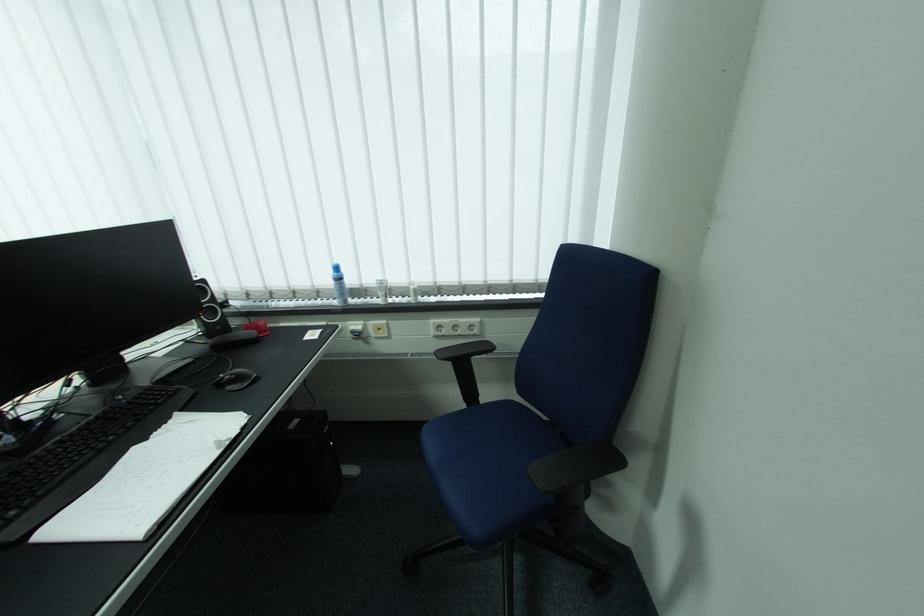
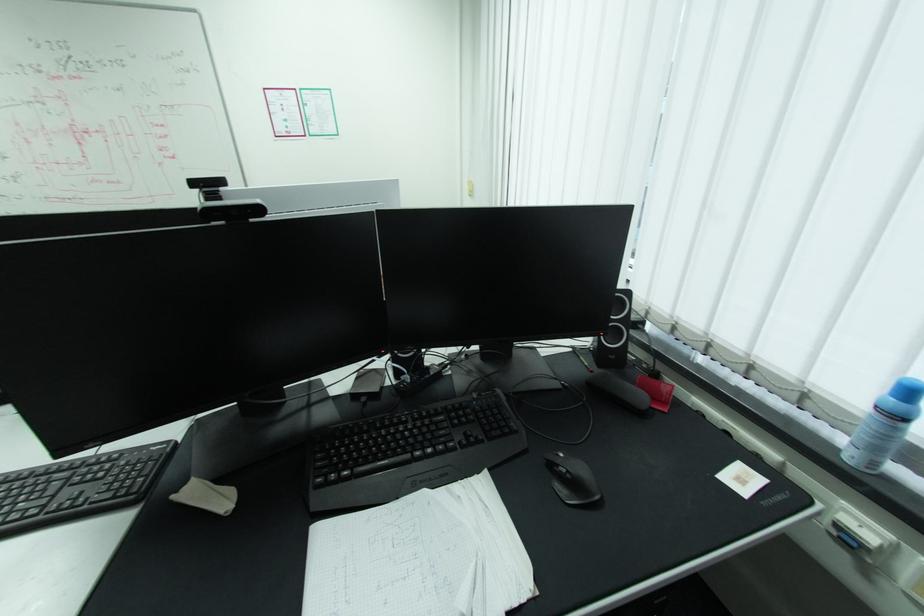
The images are taken continuously from a first-person perspective. In which direction is your viewpoint rotating?

The rotation direction of the camera is left-down.